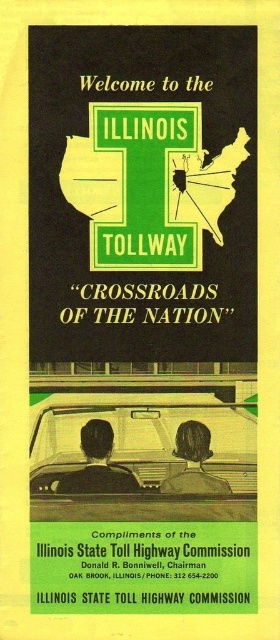
You are a graphic designer reviewing the vintage promotional poster for the Illinois Tollway. You need to ensure that the green matte sign at upper center and the matte black car at center are positioned correctly. Based on the spatial relationship between them, which object is wider?

The green matte sign at upper center might be wider than matte black car at center according to the description provided.